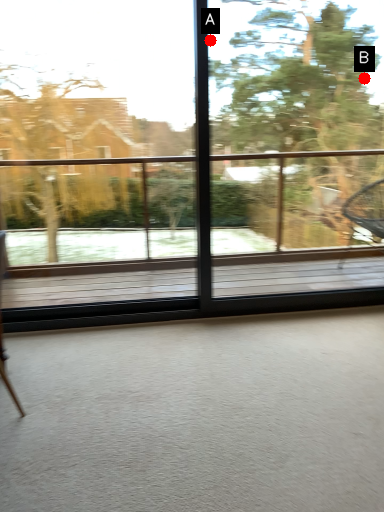
Question: Two points are circled on the image, labeled by A and B beside each circle. Among these points, which one is nearest to the camera?

Choices:
 (A) A is closer
 (B) B is closer

Answer: (A)